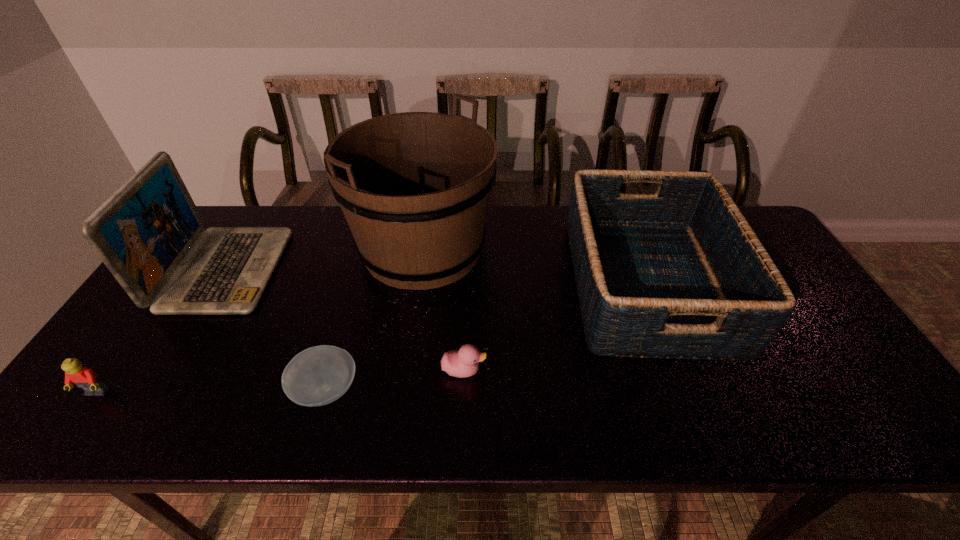
I want to click on object that is at the far left corner, so click(150, 226).

Identify the location of object at the near left corner. (85, 378).

Where is `free space at the far edge of the desktop`? The image size is (960, 540). free space at the far edge of the desktop is located at coordinates (522, 222).

Locate an element on the screen. This screenshot has height=540, width=960. vacant space at the near edge of the desktop is located at coordinates (655, 404).

Find the location of a particular element. Image resolution: width=960 pixels, height=540 pixels. free region at the right edge of the desktop is located at coordinates (827, 369).

The width and height of the screenshot is (960, 540). What are the coordinates of `free area in between the shortest object and the tallest object` in the screenshot? It's located at (374, 319).

Locate an element on the screen. vacant space in between the shortest object and the laptop computer is located at coordinates (276, 330).

I want to click on vacant space in between the shortest object and the second tallest object, so click(x=276, y=330).

You are a GUI agent. You are given a task and a screenshot of the screen. Output one action in this format:
    pyautogui.click(x=<x>, y=<y>)
    Task: Click on the blank region between the shortest object and the Lego
    Image resolution: width=960 pixels, height=540 pixels.
    Given the screenshot: What is the action you would take?
    pyautogui.click(x=211, y=392)

Find the location of a particular element. free spot between the duckling and the fourth tallest object is located at coordinates (280, 382).